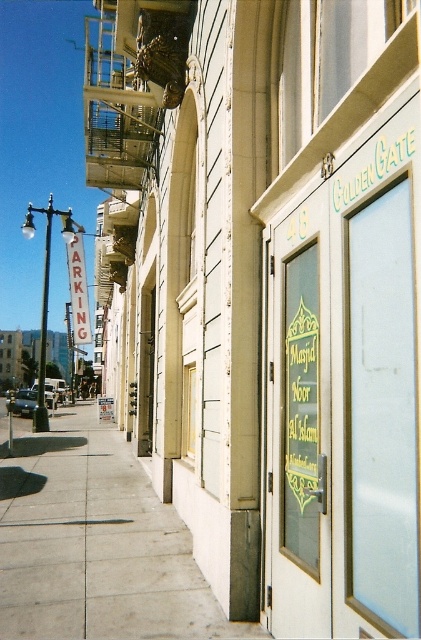
Who is positioned more to the left, concrete sidewalk at lower left or green glass door at upper center?

concrete sidewalk at lower left

The width and height of the screenshot is (421, 640). I want to click on concrete sidewalk at lower left, so (x=95, y=541).

Who is more distant from viewer, (20, 592) or (341, 106)?

The point (20, 592) is more distant.

Identify the location of concrete sidewalk at lower left. The height and width of the screenshot is (640, 421). (95, 541).

Can you confirm if translucent glass door at center is positioned to the left of green glass door at upper center?

Correct, you'll find translucent glass door at center to the left of green glass door at upper center.

From the picture: Who is lower down, translucent glass door at center or green glass door at upper center?

translucent glass door at center is lower down.

Who is more forward, (306, 374) or (416, 52)?

Point (416, 52)

I want to click on translucent glass door at center, so click(301, 412).

Does white plastic parking sign at left have a larger size compared to clear glass window at center?

Indeed, white plastic parking sign at left has a larger size compared to clear glass window at center.

How much distance is there between white plastic parking sign at left and clear glass window at center?

white plastic parking sign at left and clear glass window at center are 16.58 meters apart.

What are the coordinates of `white plastic parking sign at left` in the screenshot? It's located at (77, 289).